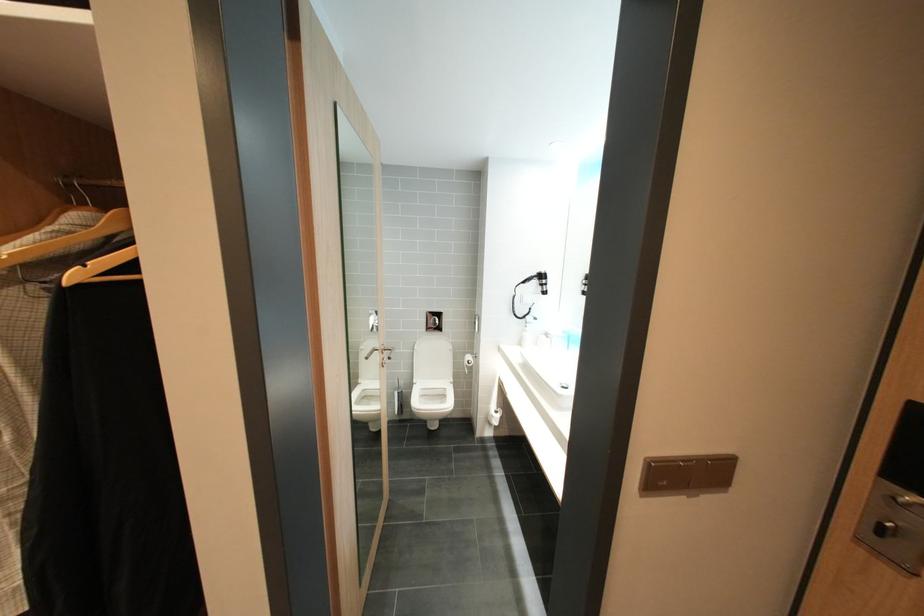
Where is `black hair dryer`? This screenshot has height=616, width=924. black hair dryer is located at coordinates (535, 282).